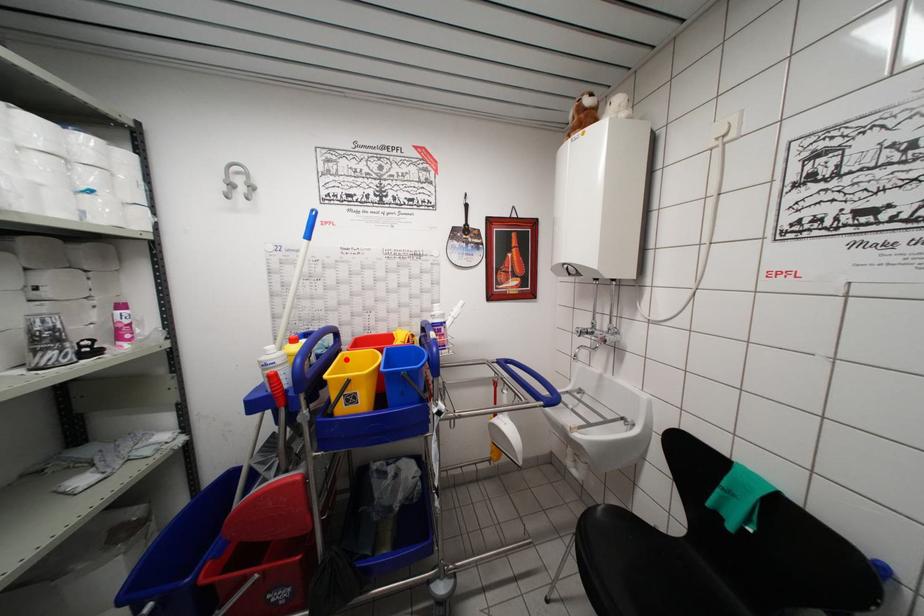
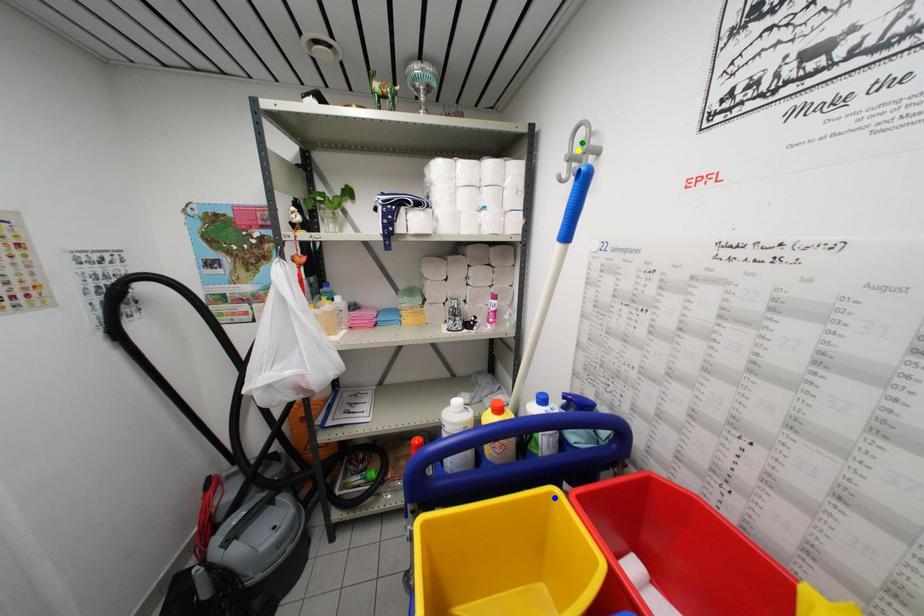
Question: I am providing you with two images of the same scene from different viewpoints. A red point is marked on the first image. You are given multiple points on the second image. Which spot in image 2 lines up with the point in image 1?

Choices:
 (A) blue point
 (B) green point
 (C) yellow point

Answer: (A)